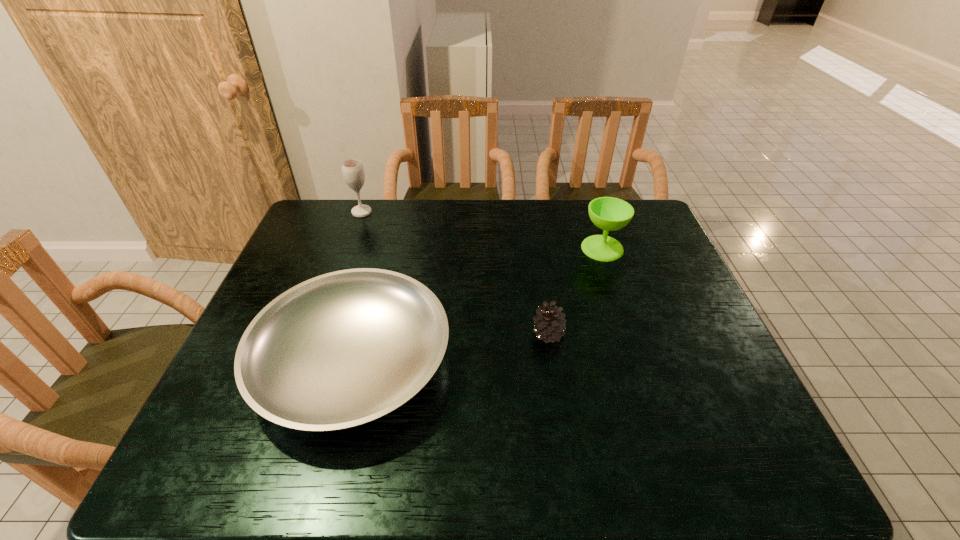
The image size is (960, 540). In the image, there is a desktop. What are the coordinates of `free region at the right edge` in the screenshot? It's located at (627, 245).

In order to click on vacant area at the far left corner of the desktop in this screenshot , I will do `click(348, 219)`.

Identify the location of vacant area at the near left corner of the desktop. (197, 447).

The image size is (960, 540). Find the location of `free location at the far right corner`. free location at the far right corner is located at coordinates (644, 208).

Where is `empty space that is in between the taller wineglass and the third nearest object`? This screenshot has width=960, height=540. empty space that is in between the taller wineglass and the third nearest object is located at coordinates (482, 230).

Where is `free space between the second object from right to left and the third nearest object`? The height and width of the screenshot is (540, 960). free space between the second object from right to left and the third nearest object is located at coordinates (575, 291).

Identify the location of free area in between the shortest object and the rightmost object. (478, 305).

Locate an element on the screen. free space that is in between the right wineglass and the second object from right to left is located at coordinates (575, 291).

At what (x,y) coordinates should I click in order to perform the action: click on vacant space that's between the right wineglass and the third object from left to right. Please return your answer as a coordinate pair (x, y). This screenshot has width=960, height=540. Looking at the image, I should click on (575, 291).

Locate an element on the screen. The height and width of the screenshot is (540, 960). free area in between the shorter wineglass and the farther wineglass is located at coordinates (482, 230).